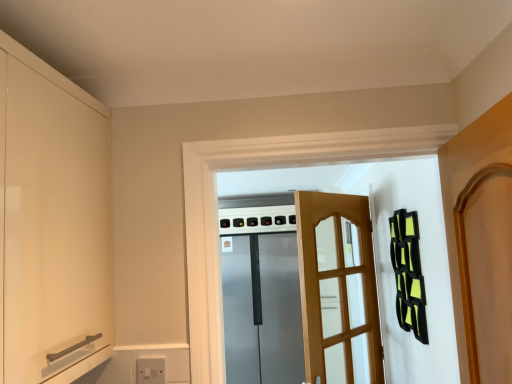
Question: Is light brown wooden screen door at center, which is the second screen door from back to front, wider or thinner than matte white cabinet at left?

Choices:
 (A) wide
 (B) thin

Answer: (B)

Question: Do you think light brown wooden screen door at center, which is the second screen door from back to front, is within matte white cabinet at left, or outside of it?

Choices:
 (A) inside
 (B) outside

Answer: (B)

Question: Based on their relative distances, which object is farther from the matte white cabinet at left?

Choices:
 (A) satin silver refrigerator at center, the 2th screen door viewed from the front
 (B) light brown wooden screen door at center, which is the second screen door from back to front

Answer: (A)

Question: Which object is positioned closest to the matte white cabinet at left?

Choices:
 (A) light brown wooden screen door at center, which is the second screen door from back to front
 (B) satin silver refrigerator at center, marked as the 1th screen door in a back-to-front arrangement

Answer: (A)